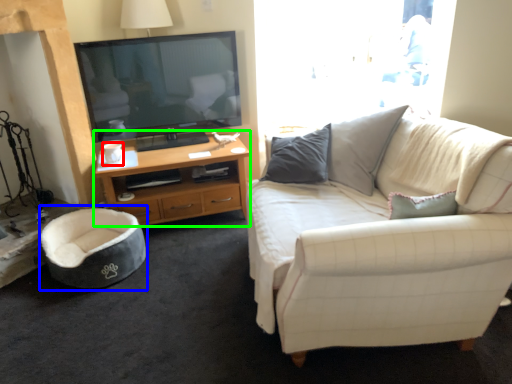
Question: Which is farther away from coffee cup (highlighted by a red box)? bean bag chair (highlighted by a blue box) or desk (highlighted by a green box)?

Choices:
 (A) bean bag chair
 (B) desk

Answer: (A)